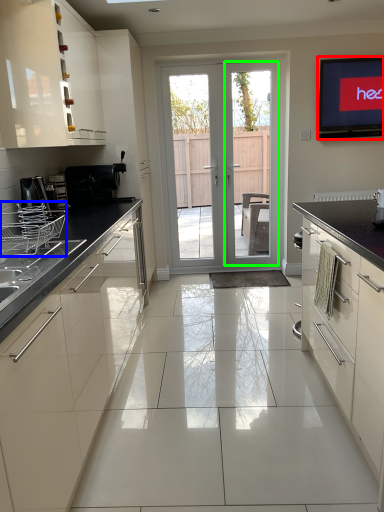
Question: Which object is the closest to the electronic (highlighted by a red box)? Choose among these: appliance (highlighted by a blue box) or screen door (highlighted by a green box).

Choices:
 (A) appliance
 (B) screen door

Answer: (B)